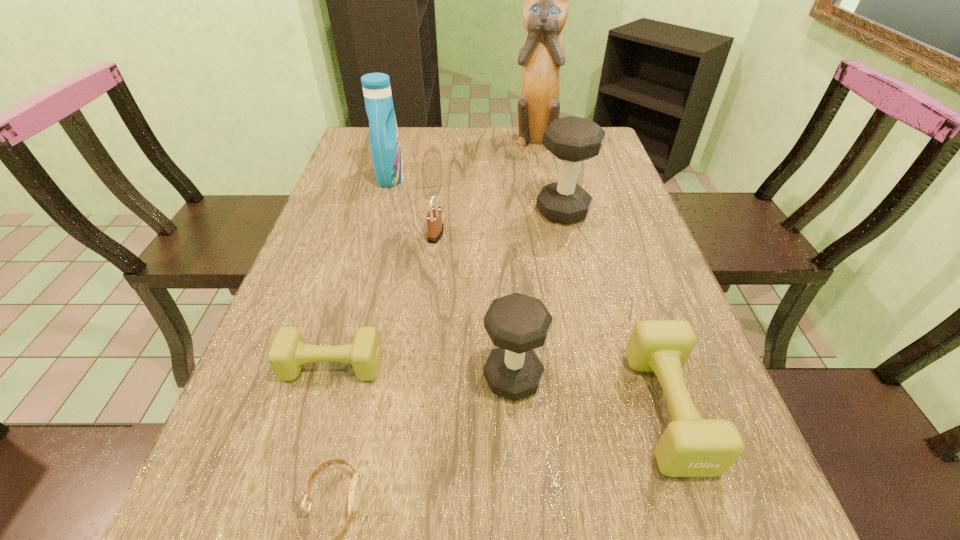
At what (x,y) coordinates should I click in order to perform the action: click on object located at the far edge. Please return your answer as a coordinate pair (x, y). The width and height of the screenshot is (960, 540). Looking at the image, I should click on (545, 8).

Where is `detergent that is at the left edge`? The image size is (960, 540). detergent that is at the left edge is located at coordinates (384, 139).

This screenshot has height=540, width=960. Find the location of `dumbbell present at the left edge`. dumbbell present at the left edge is located at coordinates click(288, 353).

I want to click on vacant space at the far edge of the desktop, so click(x=501, y=132).

In the image, there is a desktop. What are the coordinates of `vacant region at the near edge` in the screenshot? It's located at tap(360, 528).

Image resolution: width=960 pixels, height=540 pixels. Identify the location of free space at the left edge of the desktop. (365, 178).

This screenshot has width=960, height=540. What are the coordinates of `vacant region at the right edge of the desktop` in the screenshot? It's located at (669, 502).

You are a GUI agent. You are given a task and a screenshot of the screen. Output one action in this format:
    pyautogui.click(x=<x>, y=<y>)
    Task: Click on the free space that is in between the leftmost dumbbell and the bigger gray dumbbell
    The width and height of the screenshot is (960, 540).
    Given the screenshot: What is the action you would take?
    pyautogui.click(x=447, y=288)

The height and width of the screenshot is (540, 960). Identify the location of vacant area between the second farthest object and the nearer gray dumbbell. (452, 278).

At what (x,y) coordinates should I click in order to perform the action: click on free space that is in between the seventh tallest object and the sixth shortest object. Please return your answer as a coordinate pair (x, y). Looking at the image, I should click on (447, 288).